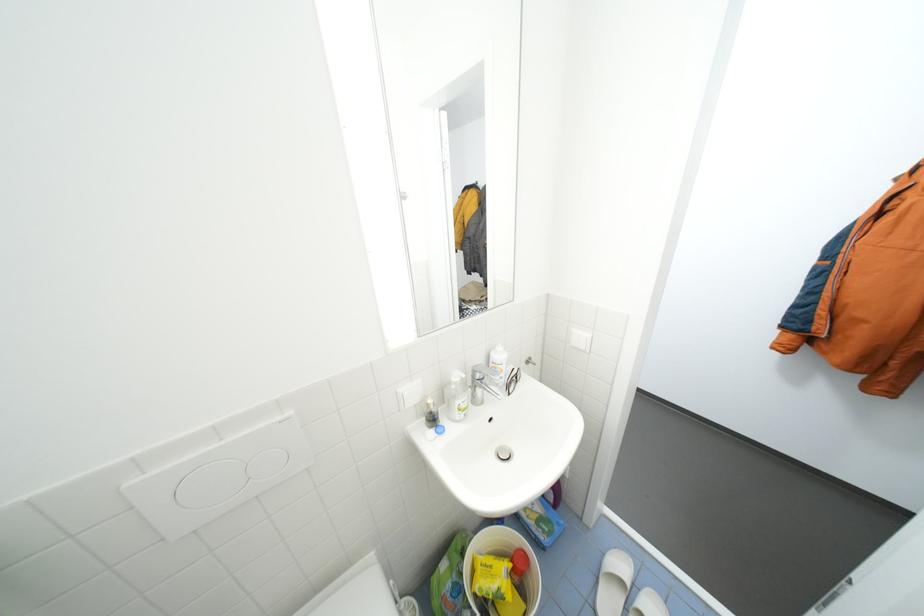
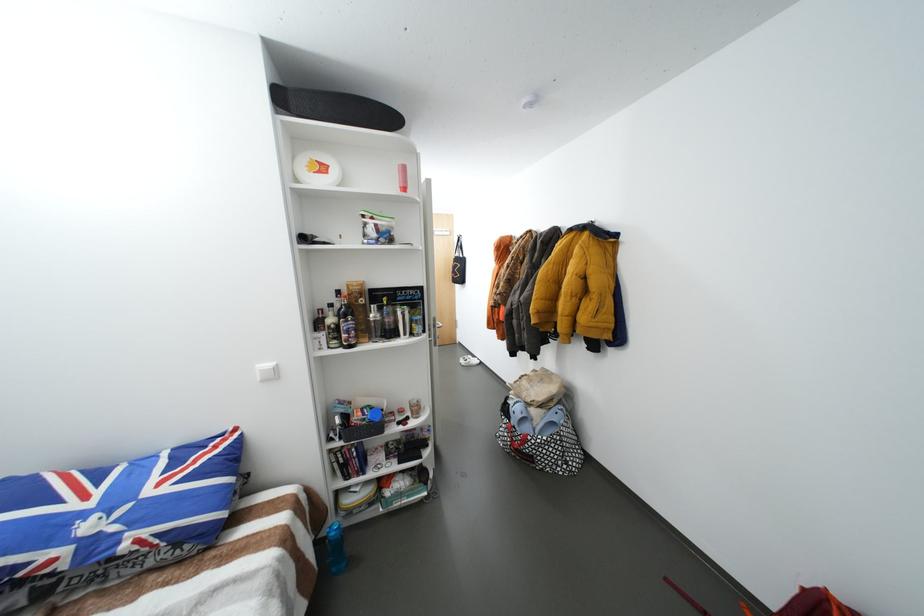
What movement of the cameraman would produce the second image?

The movement direction of the cameraman is right, backward.